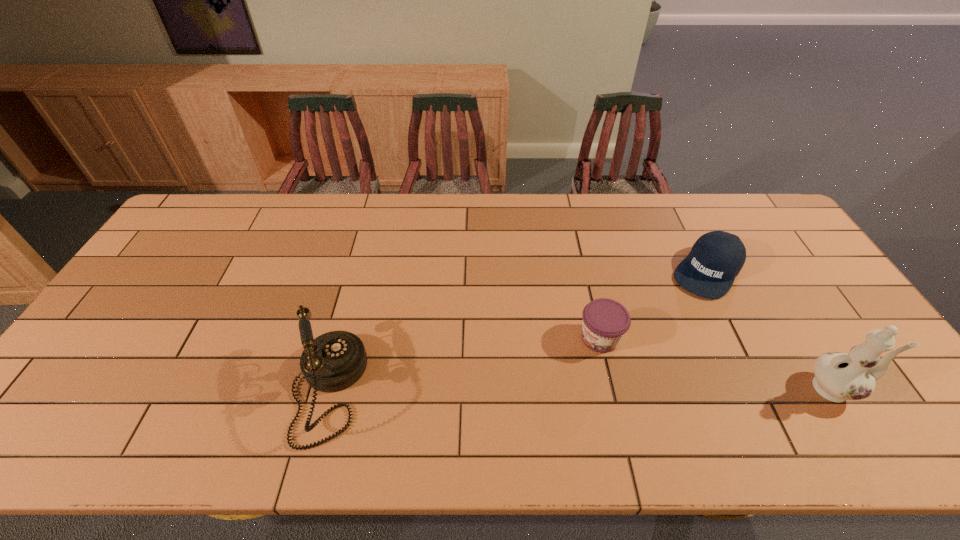
Locate an element on the screen. free space located 0.190m on the front label of the second object from left to right is located at coordinates (529, 388).

Where is `free space located on the front label of the second object from left to right`? The width and height of the screenshot is (960, 540). free space located on the front label of the second object from left to right is located at coordinates (514, 400).

Identify the location of telephone at the near edge. (334, 361).

This screenshot has width=960, height=540. I want to click on chinaware positioned at the near edge, so click(x=839, y=377).

Locate an element on the screen. The width and height of the screenshot is (960, 540). object located at the right edge is located at coordinates (839, 377).

In order to click on object that is positioned at the near right corner in this screenshot , I will do `click(839, 377)`.

I want to click on free spot at the far edge of the desktop, so click(686, 197).

What are the coordinates of `vacant area at the near edge of the desktop` in the screenshot? It's located at (404, 400).

Where is `vacant area at the right edge`? This screenshot has width=960, height=540. vacant area at the right edge is located at coordinates (775, 278).

Find the location of a particular element. free point at the far left corner is located at coordinates (215, 227).